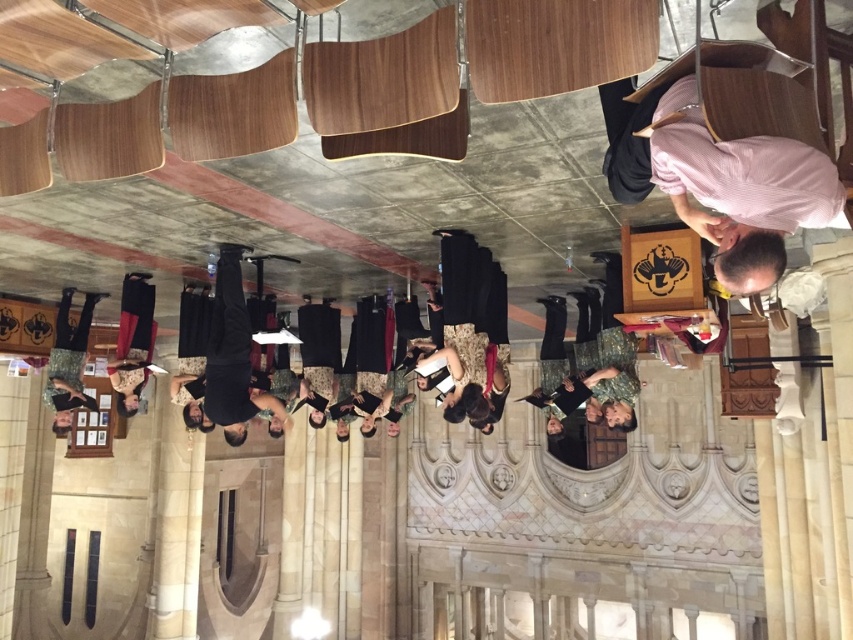
Question: Can you confirm if black matte suit at center is wider than black dress at lower left?

Choices:
 (A) yes
 (B) no

Answer: (B)

Question: Based on their relative distances, which object is farther from the black matte suit at center?

Choices:
 (A) pink striped shirt at upper right
 (B) dark green dress at center

Answer: (A)

Question: Is dark green dress at center positioned before black dress at lower left?

Choices:
 (A) no
 (B) yes

Answer: (B)

Question: Which of these objects is positioned farthest from the dark green dress at center?

Choices:
 (A) pink striped shirt at upper right
 (B) black matte suit at center
 (C) black dress at lower left

Answer: (A)

Question: Which is nearer to the pink striped shirt at upper right?

Choices:
 (A) black matte suit at center
 (B) dark green dress at center
 (C) black dress at lower left

Answer: (A)

Question: Is pink striped shirt at upper right in front of dark green dress at center?

Choices:
 (A) no
 (B) yes

Answer: (B)